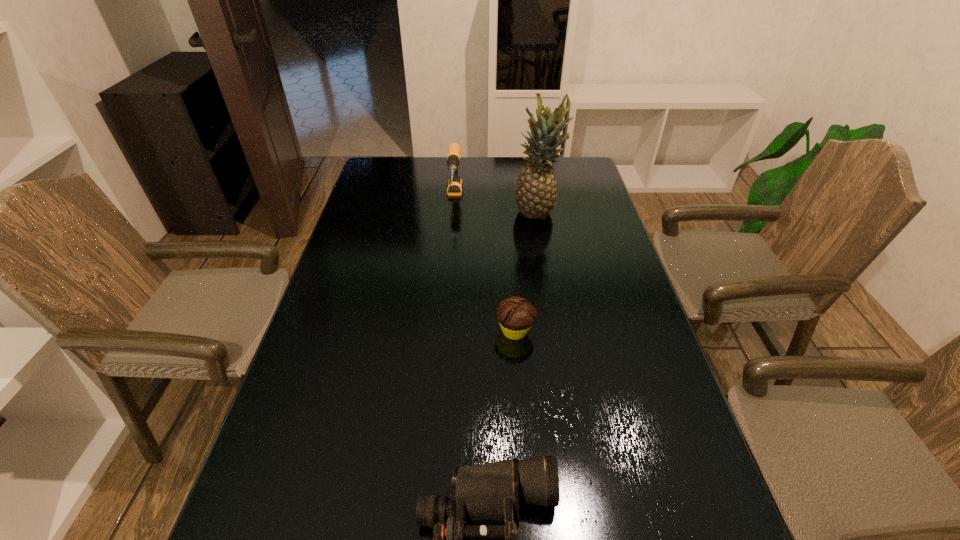
Where is `free location at the right edge`? The image size is (960, 540). free location at the right edge is located at coordinates (641, 345).

This screenshot has width=960, height=540. I want to click on free space at the far right corner, so click(x=594, y=181).

The image size is (960, 540). What are the coordinates of `free area in between the third farthest object and the drill` in the screenshot? It's located at (485, 265).

At what (x,y) coordinates should I click in order to perform the action: click on vacant space in between the pineapple and the muffin. Please return your answer as a coordinate pair (x, y). Looking at the image, I should click on (526, 272).

Where is `free space between the muffin and the third shortest object`? The width and height of the screenshot is (960, 540). free space between the muffin and the third shortest object is located at coordinates (485, 265).

Choose which object is the second nearest neighbor to the muffin. Please provide its 2D coordinates. Your answer should be formatted as a tuple, i.e. [(x, y)], where the tuple contains the x and y coordinates of a point satisfying the conditions above.

[(536, 192)]

Locate which object ranks in proximity to the nearest object. Please provide its 2D coordinates. Your answer should be formatted as a tuple, i.e. [(x, y)], where the tuple contains the x and y coordinates of a point satisfying the conditions above.

[(516, 315)]

Identify the location of free location that satisfies the following two spatial constraints: 1. on the handle side of the drill; 2. on the left side of the pineapple. The height and width of the screenshot is (540, 960). (453, 212).

Locate an element on the screen. Image resolution: width=960 pixels, height=540 pixels. blank area in the image that satisfies the following two spatial constraints: 1. on the handle side of the pineapple; 2. on the left side of the drill is located at coordinates [453, 212].